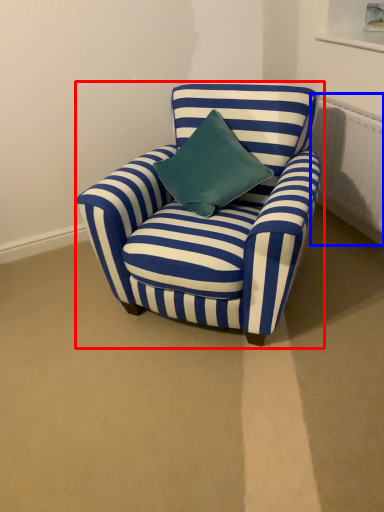
Question: Which of the following is the closest to the observer, chair (highlighted by a red box) or radiator (highlighted by a blue box)?

Choices:
 (A) chair
 (B) radiator

Answer: (A)